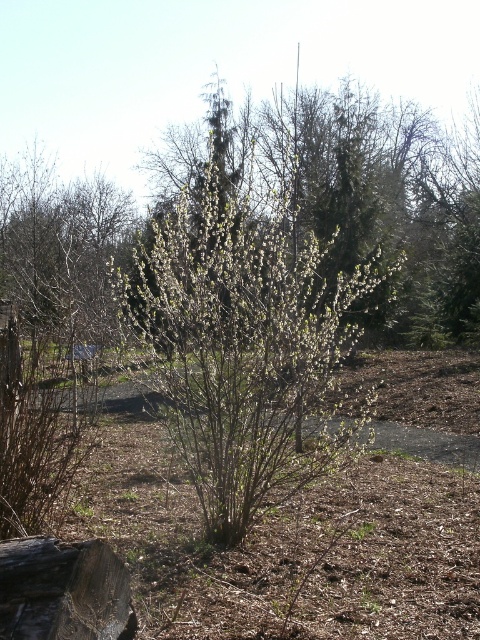
Does point (355, 577) come farther from viewer compared to point (49, 554)?

Yes.

Is brown mulch at center to the left of rough wooden log at lower left from the viewer's perspective?

No, brown mulch at center is not to the left of rough wooden log at lower left.

Describe the element at coordinates (287, 547) in the screenshot. Image resolution: width=480 pixels, height=640 pixels. I see `brown mulch at center` at that location.

Where is `brown mulch at center`? brown mulch at center is located at coordinates (287, 547).

Is green leafy bush at center below rough wooden log at lower left?

Incorrect, green leafy bush at center is not positioned below rough wooden log at lower left.

Is point (440, 209) less distant than point (106, 621)?

No.

Is point (420, 168) closer to camera compared to point (23, 579)?

That is False.

Identify the location of green leafy bush at center. The image size is (480, 640). (358, 196).

What do you see at coordinates (287, 547) in the screenshot?
I see `brown mulch at center` at bounding box center [287, 547].

Is brown mulch at center closer to camera compared to green leafy bush at center?

Yes.

Identify the location of brown mulch at center. This screenshot has width=480, height=640. (287, 547).